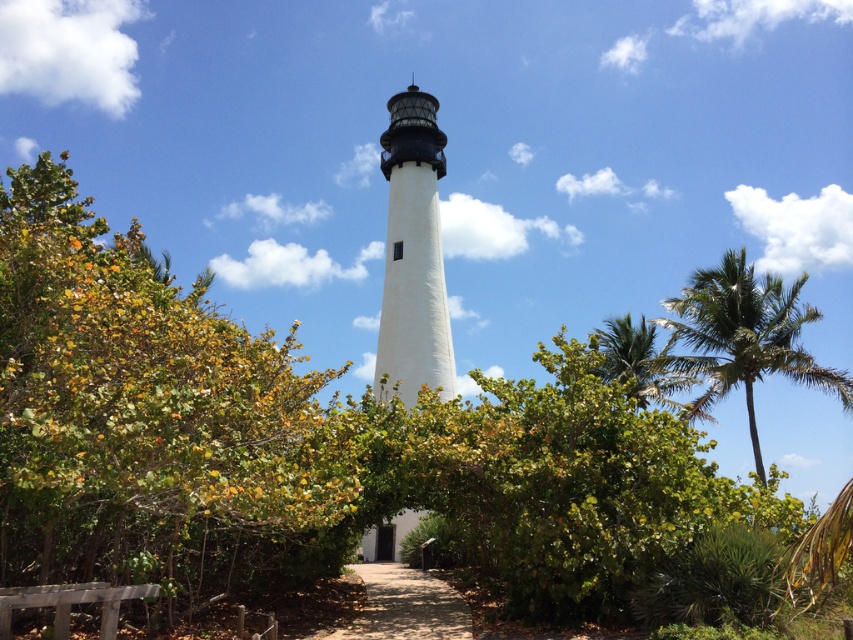
You are standing in front of the lighthouse and want to walk towards the dirt path at center. Which direction should you move relative to the green leafy bush at center?

Since the green leafy bush at center is closer to the viewer than the dirt path at center, you should move away from the green leafy bush at center to reach the dirt path at center.

You are standing in front of the lighthouse and want to walk towards the green leafy palm tree at right. Which direction should you walk to avoid the green leafy bush at center?

The green leafy bush at center is positioned over the green leafy palm tree at right, so you should walk to the left side to avoid the bush and reach the palm tree.